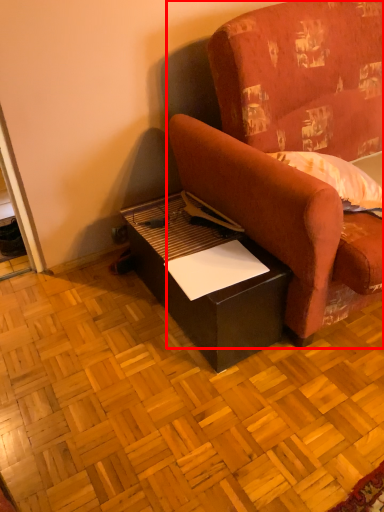
Question: From the image, what is the correct spatial relationship of studio couch (annotated by the red box) in relation to table?

Choices:
 (A) right
 (B) left

Answer: (A)